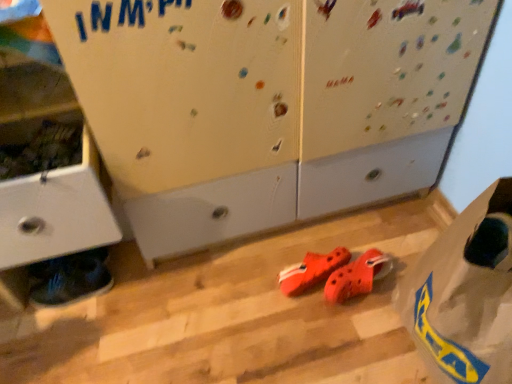
Question: From the image's perspective, does matte white cabinet at left appear higher than transparent plastic bag at lower right?

Choices:
 (A) yes
 (B) no

Answer: (A)

Question: Considering the relative positions of matte white cabinet at left and transparent plastic bag at lower right in the image provided, is matte white cabinet at left to the left of transparent plastic bag at lower right from the viewer's perspective?

Choices:
 (A) no
 (B) yes

Answer: (B)

Question: Could you tell me if matte white cabinet at left is turned towards transparent plastic bag at lower right?

Choices:
 (A) yes
 (B) no

Answer: (B)

Question: Does matte white cabinet at left have a lesser width compared to transparent plastic bag at lower right?

Choices:
 (A) yes
 (B) no

Answer: (A)

Question: Is matte white cabinet at left looking in the opposite direction of transparent plastic bag at lower right?

Choices:
 (A) yes
 (B) no

Answer: (B)

Question: In terms of size, does shiny blue sneakers at lower left, which appears as the third footwear when viewed from the right, appear bigger or smaller than orange rubber clogs at center, the 3th footwear in the left-to-right sequence?

Choices:
 (A) big
 (B) small

Answer: (A)

Question: Considering the relative positions of shiny blue sneakers at lower left, which appears as the third footwear when viewed from the right, and orange rubber clogs at center, the 3th footwear in the left-to-right sequence, in the image provided, is shiny blue sneakers at lower left, which appears as the third footwear when viewed from the right, to the left or to the right of orange rubber clogs at center, the 3th footwear in the left-to-right sequence,?

Choices:
 (A) right
 (B) left

Answer: (B)

Question: Choose the correct answer: Is shiny blue sneakers at lower left, which appears as the third footwear when viewed from the right, inside orange rubber clogs at center, the 3th footwear in the left-to-right sequence, or outside it?

Choices:
 (A) outside
 (B) inside

Answer: (A)

Question: Is shiny blue sneakers at lower left, positioned as the 1th footwear in left-to-right order, in front of or behind orange rubber clogs at center, placed as the first footwear when sorted from right to left, in the image?

Choices:
 (A) behind
 (B) front

Answer: (A)

Question: Does point (23, 109) appear closer or farther from the camera than point (44, 289)?

Choices:
 (A) closer
 (B) farther

Answer: (A)

Question: Considering their positions, is matte white cabinet at left located in front of or behind shiny blue sneakers at lower left, positioned as the 1th footwear in left-to-right order?

Choices:
 (A) behind
 (B) front

Answer: (B)

Question: Considering the positions of matte white cabinet at left and shiny blue sneakers at lower left, positioned as the 1th footwear in left-to-right order, in the image, is matte white cabinet at left taller or shorter than shiny blue sneakers at lower left, positioned as the 1th footwear in left-to-right order,?

Choices:
 (A) tall
 (B) short

Answer: (A)

Question: Is matte white cabinet at left wider or thinner than shiny blue sneakers at lower left, positioned as the 1th footwear in left-to-right order?

Choices:
 (A) wide
 (B) thin

Answer: (A)

Question: Is orange rubber clogs at center, placed as the first footwear when sorted from right to left, wider or thinner than shiny blue sneakers at lower left, positioned as the 1th footwear in left-to-right order?

Choices:
 (A) thin
 (B) wide

Answer: (B)

Question: Considering the relative positions of orange rubber clogs at center, placed as the first footwear when sorted from right to left, and shiny blue sneakers at lower left, positioned as the 1th footwear in left-to-right order, in the image provided, is orange rubber clogs at center, placed as the first footwear when sorted from right to left, to the left or to the right of shiny blue sneakers at lower left, positioned as the 1th footwear in left-to-right order,?

Choices:
 (A) left
 (B) right

Answer: (B)